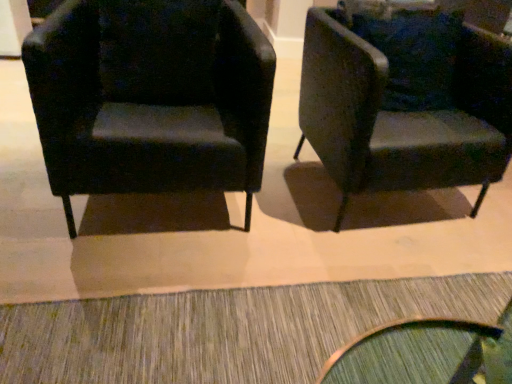
Image resolution: width=512 pixels, height=384 pixels. What are the coordinates of `blank space situated above textured gray doormat at lower center (from a real-world perspective)` in the screenshot? It's located at (234, 344).